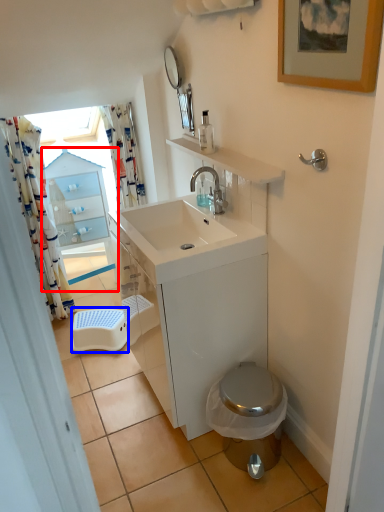
Question: Which object appears farthest to the camera in this image, glass door (highlighted by a red box) or step stool (highlighted by a blue box)?

Choices:
 (A) glass door
 (B) step stool

Answer: (A)